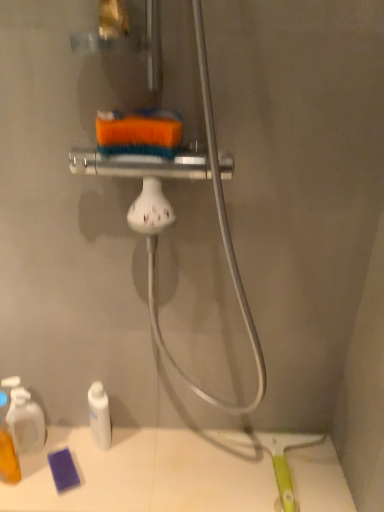
Question: Could you tell me if translucent plastic bottle at lower left, placed as the first toiletry when sorted from left to right, is turned towards translucent plastic spray bottle at lower left, placed as the second toiletry when sorted from right to left?

Choices:
 (A) no
 (B) yes

Answer: (A)

Question: Is translucent plastic bottle at lower left, placed as the first toiletry when sorted from left to right, at the left side of translucent plastic spray bottle at lower left, arranged as the second toiletry when viewed from the left?

Choices:
 (A) no
 (B) yes

Answer: (B)

Question: Does translucent plastic bottle at lower left, placed as the first toiletry when sorted from left to right, have a smaller size compared to translucent plastic spray bottle at lower left, arranged as the second toiletry when viewed from the left?

Choices:
 (A) no
 (B) yes

Answer: (A)

Question: Can you confirm if translucent plastic bottle at lower left, placed as the third toiletry when sorted from right to left, is taller than translucent plastic spray bottle at lower left, placed as the second toiletry when sorted from right to left?

Choices:
 (A) yes
 (B) no

Answer: (A)

Question: Is translucent plastic bottle at lower left, placed as the third toiletry when sorted from right to left, closer to the viewer compared to translucent plastic spray bottle at lower left, arranged as the second toiletry when viewed from the left?

Choices:
 (A) no
 (B) yes

Answer: (B)

Question: Does translucent plastic bottle at lower left, placed as the third toiletry when sorted from right to left, have a greater width compared to translucent plastic spray bottle at lower left, placed as the second toiletry when sorted from right to left?

Choices:
 (A) no
 (B) yes

Answer: (B)

Question: Considering the relative sizes of purple sponge at lower left and white matte bottle at lower left, which is the 3th toiletry from left to right, in the image provided, is purple sponge at lower left bigger than white matte bottle at lower left, which is the 3th toiletry from left to right,?

Choices:
 (A) no
 (B) yes

Answer: (B)

Question: Is purple sponge at lower left at the right side of white matte bottle at lower left, the 1th toiletry positioned from the right?

Choices:
 (A) yes
 (B) no

Answer: (A)

Question: Does purple sponge at lower left have a greater width compared to white matte bottle at lower left, the 1th toiletry positioned from the right?

Choices:
 (A) yes
 (B) no

Answer: (A)

Question: Is there a large distance between purple sponge at lower left and white matte bottle at lower left, which is the 3th toiletry from left to right?

Choices:
 (A) yes
 (B) no

Answer: (B)

Question: Considering the relative sizes of purple sponge at lower left and white matte bottle at lower left, which is the 3th toiletry from left to right, in the image provided, is purple sponge at lower left shorter than white matte bottle at lower left, which is the 3th toiletry from left to right,?

Choices:
 (A) yes
 (B) no

Answer: (A)

Question: From a real-world perspective, is purple sponge at lower left on top of white matte bottle at lower left, the 1th toiletry positioned from the right?

Choices:
 (A) yes
 (B) no

Answer: (B)

Question: From a real-world perspective, is translucent plastic bottle at lower left, placed as the third toiletry when sorted from right to left, located beneath white matte bottle at lower left, the 1th toiletry positioned from the right?

Choices:
 (A) yes
 (B) no

Answer: (B)